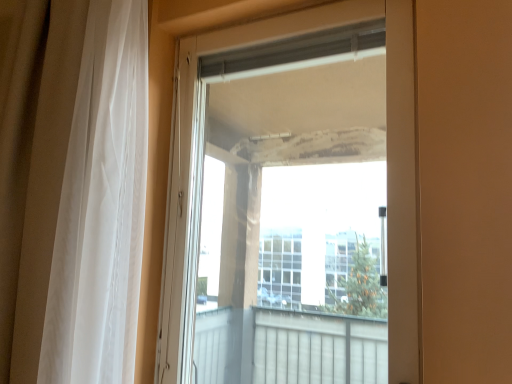
Question: Is white sheer curtain at left facing towards transparent glass door at center?

Choices:
 (A) yes
 (B) no

Answer: (B)

Question: Does white sheer curtain at left have a larger size compared to transparent glass door at center?

Choices:
 (A) no
 (B) yes

Answer: (B)

Question: Can you confirm if white sheer curtain at left is positioned to the left of transparent glass door at center?

Choices:
 (A) yes
 (B) no

Answer: (A)

Question: Is white sheer curtain at left to the right of transparent glass door at center from the viewer's perspective?

Choices:
 (A) no
 (B) yes

Answer: (A)

Question: Is white sheer curtain at left beside transparent glass door at center?

Choices:
 (A) yes
 (B) no

Answer: (B)

Question: From the image's perspective, does white sheer curtain at left appear higher than transparent glass door at center?

Choices:
 (A) no
 (B) yes

Answer: (B)

Question: Is transparent glass door at center wider than white sheer curtain at left?

Choices:
 (A) no
 (B) yes

Answer: (A)

Question: Considering the relative positions of transparent glass door at center and white sheer curtain at left in the image provided, is transparent glass door at center to the right of white sheer curtain at left from the viewer's perspective?

Choices:
 (A) yes
 (B) no

Answer: (A)

Question: Can you confirm if transparent glass door at center is taller than white sheer curtain at left?

Choices:
 (A) no
 (B) yes

Answer: (A)

Question: Can you confirm if transparent glass door at center is thinner than white sheer curtain at left?

Choices:
 (A) no
 (B) yes

Answer: (B)

Question: Can you confirm if transparent glass door at center is shorter than white sheer curtain at left?

Choices:
 (A) yes
 (B) no

Answer: (A)

Question: Would you say transparent glass door at center contains white sheer curtain at left?

Choices:
 (A) yes
 (B) no

Answer: (B)

Question: Is point (112, 357) positioned closer to the camera than point (413, 372)?

Choices:
 (A) closer
 (B) farther

Answer: (B)